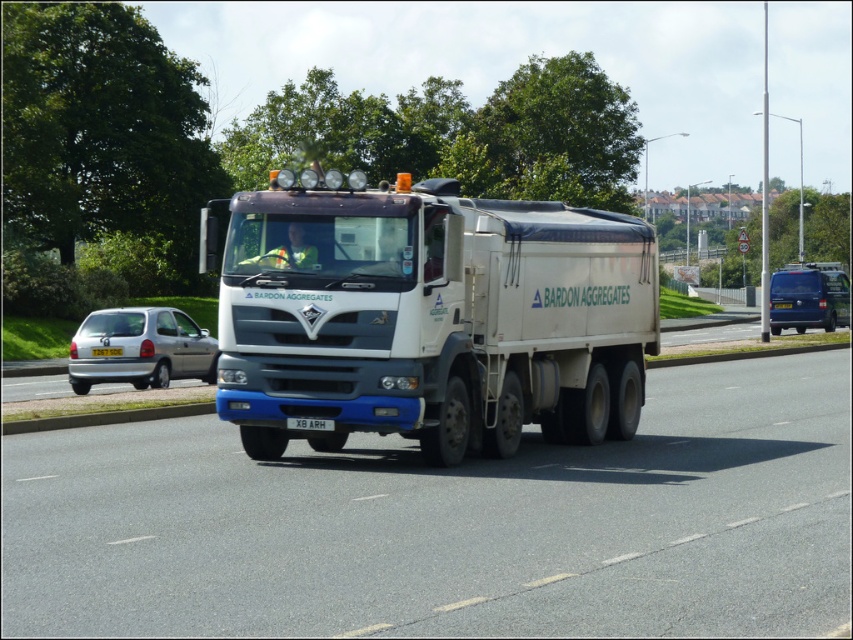
You are a photographer standing on the sidewalk. You want to take a photo of the white matte trailer truck at center and the black plastic license plate at center. Which object will appear larger in your photo?

The white matte trailer truck at center will appear larger in the photo because it is closer to the photographer than the black plastic license plate at center.

You are a photographer trying to capture the silver metallic hatchback at left and the yellow plastic license plate at center in the same frame. Which object should you focus on first to ensure both are in the frame?

You should focus on the silver metallic hatchback at left first because it is wider than the yellow plastic license plate at center, so positioning the camera to include the wider object first ensures both will fit in the frame.

You are standing at the point marked by the coordinates point (140, 348). Looking around, you see the large white and blue truck from Bardon Aggregates and the silver car. Which vehicle are you closest to?

A: The point (140, 348) is on the silver metallic hatchback at left, so you are closest to the silver metallic hatchback at left.